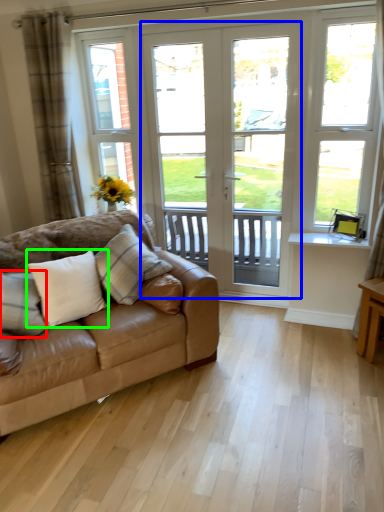
Question: Which is nearer to the pillow (highlighted by a red box)? door (highlighted by a blue box) or pillow (highlighted by a green box).

Choices:
 (A) door
 (B) pillow

Answer: (B)